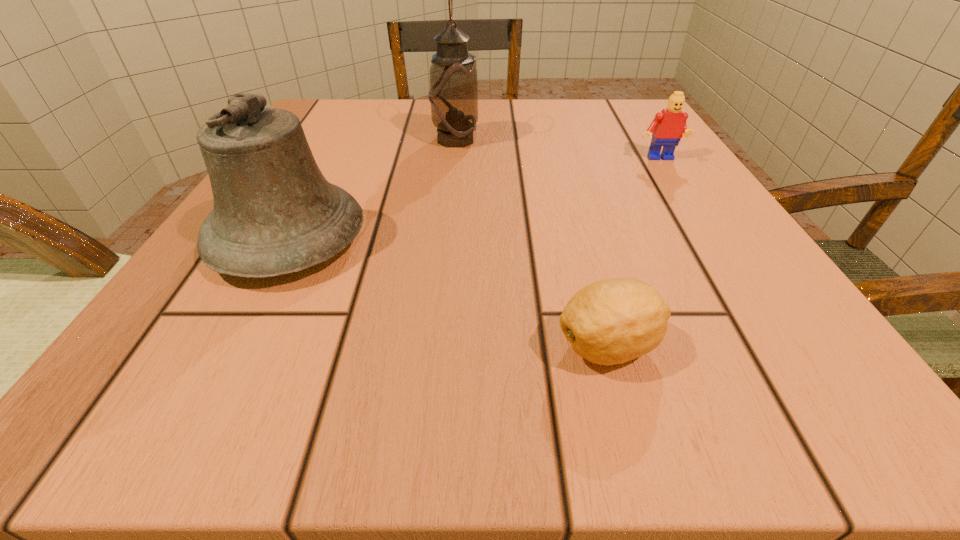
Locate an element on the screen. oil lamp is located at coordinates (453, 95).

The image size is (960, 540). I want to click on the second object from left to right, so click(x=453, y=95).

This screenshot has width=960, height=540. Identify the location of the second tallest object. (274, 213).

You are a GUI agent. You are given a task and a screenshot of the screen. Output one action in this format:
    pyautogui.click(x=<x>, y=<y>)
    Task: Click on the leftmost object
    The width and height of the screenshot is (960, 540).
    Given the screenshot: What is the action you would take?
    pyautogui.click(x=274, y=213)

I want to click on the rightmost object, so click(x=668, y=126).

Where is `Lego`? Lego is located at coordinates (668, 126).

Image resolution: width=960 pixels, height=540 pixels. Find the location of `the shortest object`. the shortest object is located at coordinates (612, 321).

At what (x,y) coordinates should I click in order to perform the action: click on the third object from left to right. Please return your answer as a coordinate pair (x, y). Looking at the image, I should click on (612, 321).

Where is `free space located 0.120m on the front of the tallest object`? Image resolution: width=960 pixels, height=540 pixels. free space located 0.120m on the front of the tallest object is located at coordinates (451, 184).

What are the coordinates of `blank space located on the back of the second tallest object` in the screenshot? It's located at (349, 126).